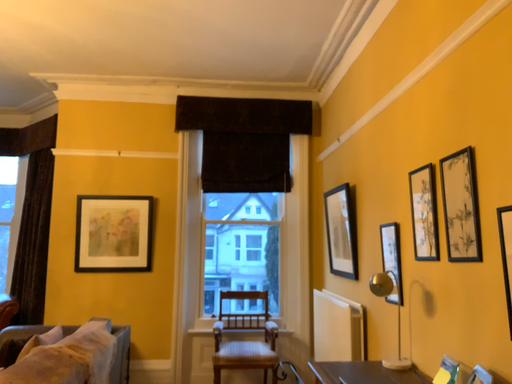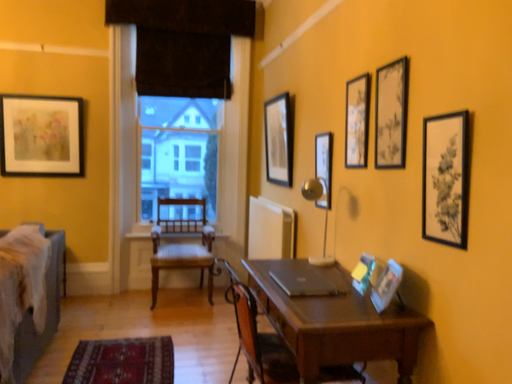
Question: How did the camera likely rotate when shooting the video?

Choices:
 (A) rotated upward
 (B) rotated downward

Answer: (B)